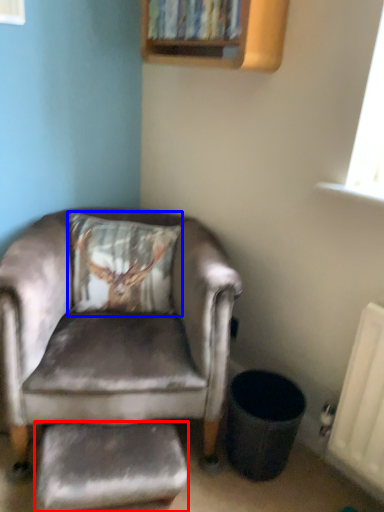
Question: Which of the following is the closest to the observer, footrest (highlighted by a red box) or pillow (highlighted by a blue box)?

Choices:
 (A) footrest
 (B) pillow

Answer: (A)